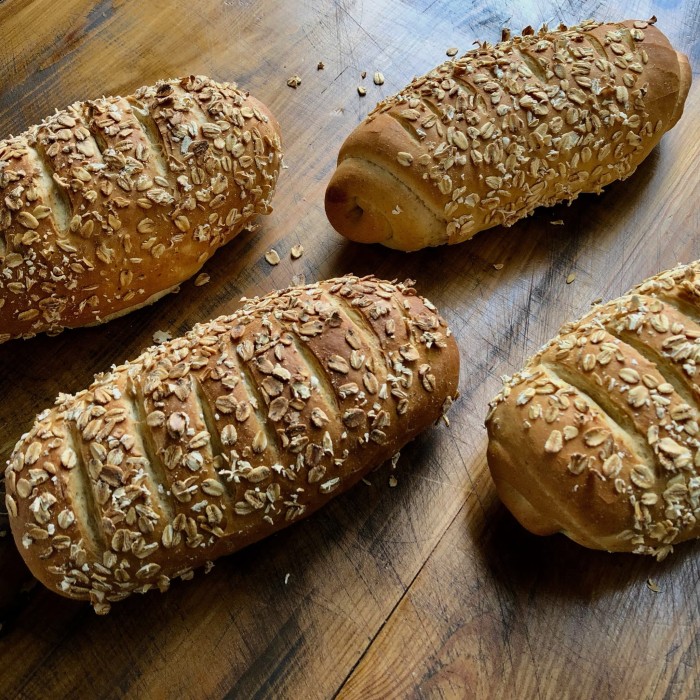
Find the location of a particular element. This screenshot has width=700, height=700. table is located at coordinates 374,598.